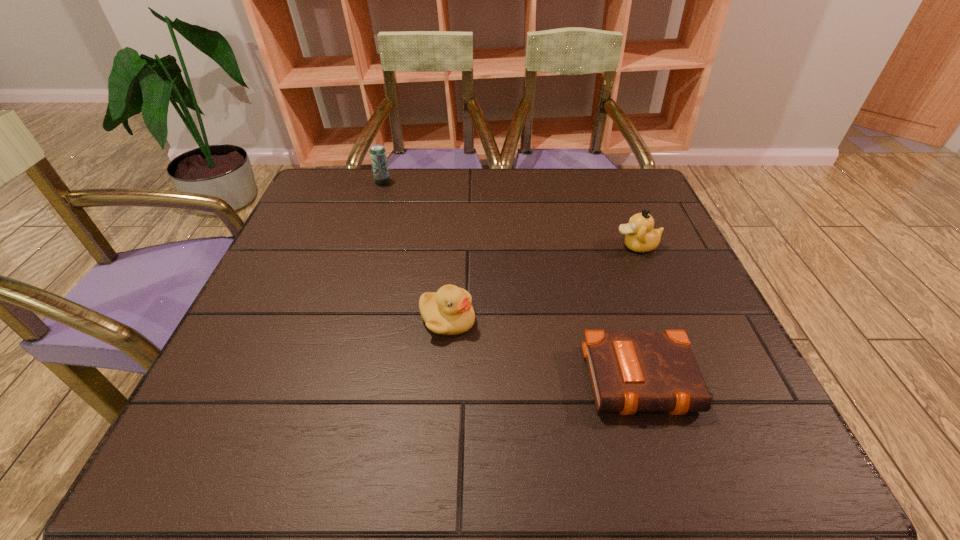
You are a GUI agent. You are given a task and a screenshot of the screen. Output one action in this format:
    pyautogui.click(x=<x>, y=<y>)
    Task: Click on the farthest object
    Image resolution: width=960 pixels, height=540 pixels.
    Given the screenshot: What is the action you would take?
    pyautogui.click(x=378, y=157)

You are a GUI agent. You are given a task and a screenshot of the screen. Output one action in this format:
    pyautogui.click(x=<x>, y=<y>)
    Task: Click on the beer can
    
    Given the screenshot: What is the action you would take?
    pyautogui.click(x=378, y=157)

At what (x,y) coordinates should I click in order to perform the action: click on the right duckling. Please return your answer as a coordinate pair (x, y). Looking at the image, I should click on 640,236.

Find the location of a particular element. the farther duckling is located at coordinates (640, 236).

This screenshot has width=960, height=540. I want to click on the left duckling, so click(x=449, y=311).

Where is `the nearer duckling`? The width and height of the screenshot is (960, 540). the nearer duckling is located at coordinates (449, 311).

You are a GUI agent. You are given a task and a screenshot of the screen. Output one action in this format:
    pyautogui.click(x=<x>, y=<y>)
    Task: Click on the Bible
    
    Given the screenshot: What is the action you would take?
    [630, 372]

Where is `the nearest object`? the nearest object is located at coordinates (630, 372).

The image size is (960, 540). I want to click on vacant space situated 0.140m on the left of the beer can, so click(x=326, y=183).

Where is `free region located 0.320m on the face of the farther duckling`? Image resolution: width=960 pixels, height=540 pixels. free region located 0.320m on the face of the farther duckling is located at coordinates (483, 246).